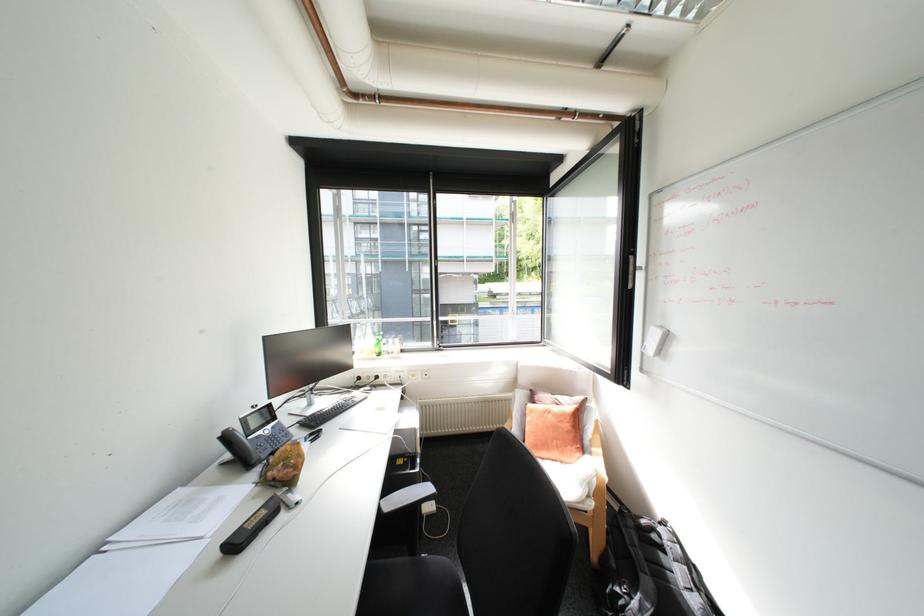
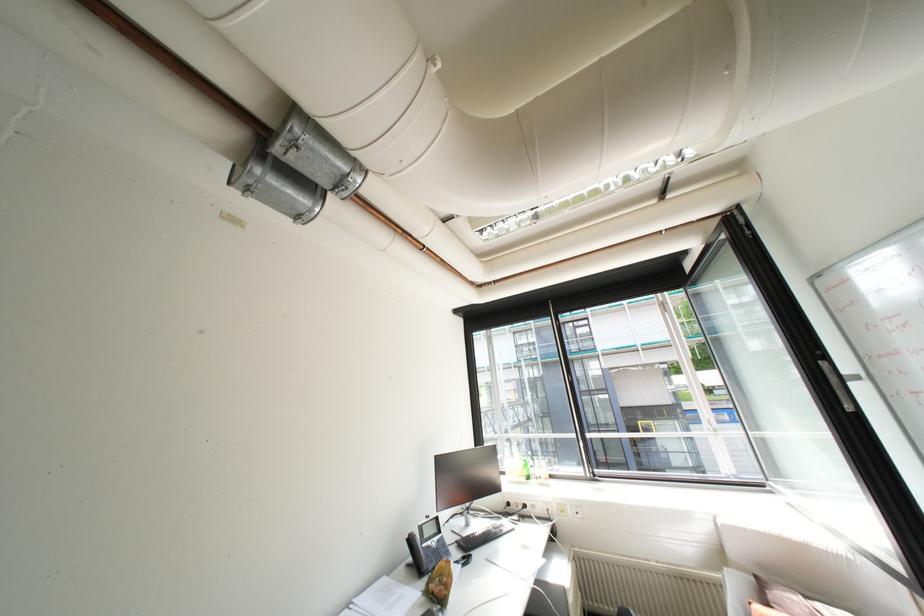
How did the camera likely rotate?

The camera's rotation is toward left-up.